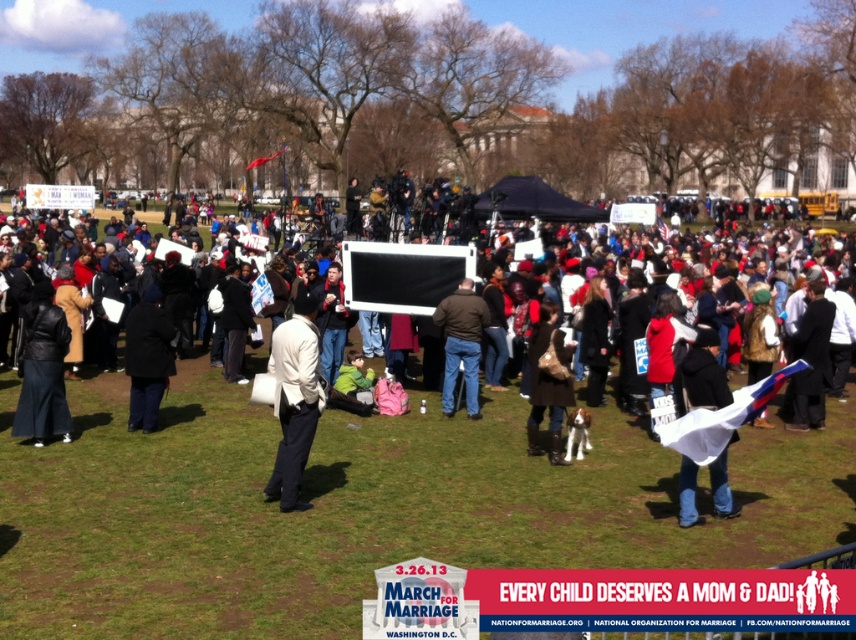
What do you see at coordinates (548, 385) in the screenshot? The image size is (856, 640). I see `brown fuzzy coat at center` at bounding box center [548, 385].

Who is taller, brown fuzzy coat at center or brown leather jacket at center?

Standing taller between the two is brown leather jacket at center.

Does point (528, 348) come in front of point (449, 408)?

Yes, it is.

Identify the location of brown fuzzy coat at center. The height and width of the screenshot is (640, 856). (548, 385).

Between point (611, 324) and point (45, 305), which one is positioned in front?

Positioned in front is point (45, 305).

Can you confirm if white matte sign at center is bigger than black leather jacket at lower left?

Yes, white matte sign at center is bigger than black leather jacket at lower left.

Is point (158, 266) farther from camera compared to point (22, 387)?

Yes, point (158, 266) is behind point (22, 387).

Locate an element on the screen. Image resolution: width=856 pixels, height=640 pixels. white matte sign at center is located at coordinates (682, 310).

Which is behind, point (56, 323) or point (545, 310)?

The point (56, 323) is more distant.

Locate an element on the screen. Image resolution: width=856 pixels, height=640 pixels. black leather jacket at lower left is located at coordinates (43, 369).